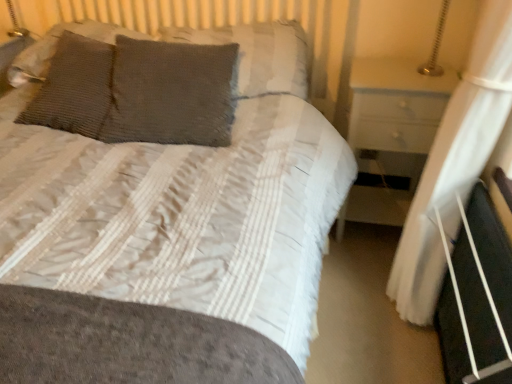
Question: Is white sheer curtain at right oriented towards gray knitted pillow at center, which is counted as the third pillow, starting from the left?

Choices:
 (A) no
 (B) yes

Answer: (B)

Question: From a real-world perspective, is white sheer curtain at right under gray knitted pillow at center, positioned as the 2th pillow in right-to-left order?

Choices:
 (A) no
 (B) yes

Answer: (B)

Question: Considering the relative positions of white sheer curtain at right and gray knitted pillow at center, which is counted as the third pillow, starting from the left, in the image provided, is white sheer curtain at right to the right of gray knitted pillow at center, which is counted as the third pillow, starting from the left, from the viewer's perspective?

Choices:
 (A) yes
 (B) no

Answer: (A)

Question: Does white sheer curtain at right have a greater width compared to gray knitted pillow at center, which is counted as the third pillow, starting from the left?

Choices:
 (A) no
 (B) yes

Answer: (A)

Question: Is gray knitted pillow at center, positioned as the 2th pillow in right-to-left order, located within white sheer curtain at right?

Choices:
 (A) no
 (B) yes

Answer: (A)

Question: Relative to black plastic bed frame at lower right, is gray textured pillow at center, positioned as the fourth pillow in left-to-right order, in front or behind?

Choices:
 (A) front
 (B) behind

Answer: (B)

Question: From a real-world perspective, is gray textured pillow at center, positioned as the fourth pillow in left-to-right order, physically located above or below black plastic bed frame at lower right?

Choices:
 (A) below
 (B) above

Answer: (B)

Question: Is gray textured pillow at center, positioned as the 1th pillow in right-to-left order, spatially inside black plastic bed frame at lower right, or outside of it?

Choices:
 (A) outside
 (B) inside

Answer: (A)

Question: Is point (242, 67) positioned closer to the camera than point (501, 233)?

Choices:
 (A) closer
 (B) farther

Answer: (B)

Question: From the image's perspective, is gray knitted pillow at center, which is counted as the third pillow, starting from the left, positioned above or below gray textured pillow at center, positioned as the 1th pillow in right-to-left order?

Choices:
 (A) below
 (B) above

Answer: (A)

Question: In terms of size, does gray knitted pillow at center, positioned as the 2th pillow in right-to-left order, appear bigger or smaller than gray textured pillow at center, positioned as the 1th pillow in right-to-left order?

Choices:
 (A) small
 (B) big

Answer: (A)

Question: In the image, is gray knitted pillow at center, positioned as the 2th pillow in right-to-left order, on the left side or the right side of gray textured pillow at center, positioned as the fourth pillow in left-to-right order?

Choices:
 (A) left
 (B) right

Answer: (A)

Question: Considering their positions, is gray knitted pillow at center, which is counted as the third pillow, starting from the left, located in front of or behind gray textured pillow at center, positioned as the 1th pillow in right-to-left order?

Choices:
 (A) behind
 (B) front

Answer: (B)

Question: Looking at the image, does gray textured pillow at center, positioned as the fourth pillow in left-to-right order, seem bigger or smaller compared to white sheer curtain at right?

Choices:
 (A) big
 (B) small

Answer: (B)

Question: Is gray textured pillow at center, positioned as the 1th pillow in right-to-left order, taller or shorter than white sheer curtain at right?

Choices:
 (A) tall
 (B) short

Answer: (B)